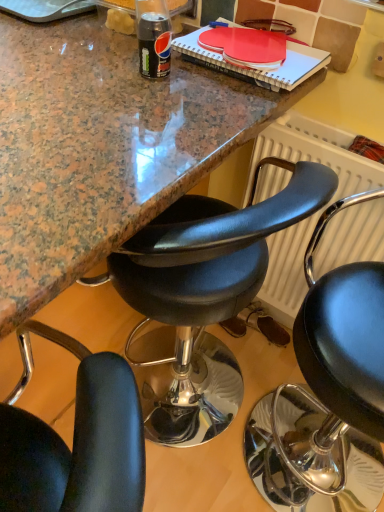
Image resolution: width=384 pixels, height=512 pixels. Describe the element at coordinates (327, 394) in the screenshot. I see `black leather chair at center, the 1th chair viewed from the right` at that location.

This screenshot has height=512, width=384. In order to click on black leather chair at center, which is the second chair from left to right in this screenshot , I will do `click(327, 394)`.

Is black leather chair at center, which is the second chair from left to right, touching white textured radiator at right?

black leather chair at center, which is the second chair from left to right, is not next to white textured radiator at right, and they're not touching.

Between point (322, 349) and point (271, 239), which one is positioned behind?

The point (271, 239) is farther.

From the image's perspective, which object appears higher, black leather chair at center, which is the second chair from left to right, or white textured radiator at right?

white textured radiator at right, from the image's perspective.

From the image's perspective, which object appears higher, white textured radiator at right or black leather chair at center, arranged as the first chair when viewed from the left?

From the image's view, white textured radiator at right is above.

Is white textured radiator at right facing away from black leather chair at center, arranged as the first chair when viewed from the left?

No, white textured radiator at right's orientation is not away from black leather chair at center, arranged as the first chair when viewed from the left.

Which point is more forward, (290, 313) or (321, 168)?

The point (321, 168) is more forward.

Can you confirm if white textured radiator at right is wider than black leather chair at center, positioned as the second chair in right-to-left order?

No, white textured radiator at right is not wider than black leather chair at center, positioned as the second chair in right-to-left order.

Which is more to the left, black leather chair at center, positioned as the second chair in right-to-left order, or white textured radiator at right?

black leather chair at center, positioned as the second chair in right-to-left order, is more to the left.

From a real-world perspective, does black leather chair at center, positioned as the second chair in right-to-left order, stand above white textured radiator at right?

No, from a real-world perspective, black leather chair at center, positioned as the second chair in right-to-left order, is not on top of white textured radiator at right.

Considering the sizes of black leather chair at center, arranged as the first chair when viewed from the left, and white textured radiator at right in the image, is black leather chair at center, arranged as the first chair when viewed from the left, wider or thinner than white textured radiator at right?

Considering their sizes, black leather chair at center, arranged as the first chair when viewed from the left, looks broader than white textured radiator at right.

Is white textured radiator at right turned away from black leather chair at center, which is the second chair from left to right?

That's not correct — white textured radiator at right is not looking away from black leather chair at center, which is the second chair from left to right.

Where is `radiator behind the black leather chair at center, the 1th chair viewed from the right`? This screenshot has height=512, width=384. radiator behind the black leather chair at center, the 1th chair viewed from the right is located at coordinates [x=316, y=153].

Is there a large distance between white textured radiator at right and black leather chair at center, which is the second chair from left to right?

No, white textured radiator at right is not far away from black leather chair at center, which is the second chair from left to right.

From a real-world perspective, is black leather chair at center, arranged as the first chair when viewed from the left, positioned above or below black leather chair at center, the 1th chair viewed from the right?

black leather chair at center, arranged as the first chair when viewed from the left, is below black leather chair at center, the 1th chair viewed from the right.

How many degrees apart are the facing directions of black leather chair at center, positioned as the second chair in right-to-left order, and black leather chair at center, which is the second chair from left to right?

black leather chair at center, positioned as the second chair in right-to-left order, and black leather chair at center, which is the second chair from left to right, are facing 0.00126 degrees away from each other.

Is black leather chair at center, positioned as the second chair in right-to-left order, next to black leather chair at center, the 1th chair viewed from the right, and touching it?

black leather chair at center, positioned as the second chair in right-to-left order, and black leather chair at center, the 1th chair viewed from the right, are not in contact.

Looking at their sizes, would you say black leather chair at center, arranged as the first chair when viewed from the left, is wider or thinner than black leather chair at center, the 1th chair viewed from the right?

black leather chair at center, arranged as the first chair when viewed from the left, is wider than black leather chair at center, the 1th chair viewed from the right.

Considering the sizes of objects black leather chair at center, which is the second chair from left to right, and black leather chair at center, positioned as the second chair in right-to-left order, in the image provided, who is bigger, black leather chair at center, which is the second chair from left to right, or black leather chair at center, positioned as the second chair in right-to-left order,?

Bigger between the two is black leather chair at center, which is the second chair from left to right.

Is black leather chair at center, the 1th chair viewed from the right, aimed at black leather chair at center, arranged as the first chair when viewed from the left?

Yes.

Consider the image. Is black leather chair at center, the 1th chair viewed from the right, outside of black leather chair at center, arranged as the first chair when viewed from the left?

Yes, black leather chair at center, the 1th chair viewed from the right, is located beyond the bounds of black leather chair at center, arranged as the first chair when viewed from the left.

Consider the image. Between black leather chair at center, the 1th chair viewed from the right, and black leather chair at center, arranged as the first chair when viewed from the left, which one has smaller width?

black leather chair at center, the 1th chair viewed from the right.

From the image's perspective, which chair is the 2nd one below the white textured radiator at right? Please provide its 2D coordinates.

[(327, 394)]

Find the location of a particular element. This screenshot has width=384, height=512. radiator that is on the right side of black leather chair at center, positioned as the second chair in right-to-left order is located at coordinates (316, 153).

From the image, which object appears to be nearer to black leather chair at center, arranged as the first chair when viewed from the left, black leather chair at center, which is the second chair from left to right, or white textured radiator at right?

white textured radiator at right is closer to black leather chair at center, arranged as the first chair when viewed from the left.

Based on their spatial positions, is black leather chair at center, which is the second chair from left to right, or black leather chair at center, arranged as the first chair when viewed from the left, closer to white textured radiator at right?

black leather chair at center, arranged as the first chair when viewed from the left, is positioned closer to the anchor white textured radiator at right.

Estimate the real-world distances between objects in this image. Which object is further from black leather chair at center, the 1th chair viewed from the right, black leather chair at center, arranged as the first chair when viewed from the left, or white textured radiator at right?

black leather chair at center, arranged as the first chair when viewed from the left.

When comparing their distances from black leather chair at center, the 1th chair viewed from the right, does white textured radiator at right or black leather chair at center, positioned as the second chair in right-to-left order, seem closer?

white textured radiator at right is positioned closer to the anchor black leather chair at center, the 1th chair viewed from the right.

Estimate the real-world distances between objects in this image. Which object is closer to black leather chair at center, positioned as the second chair in right-to-left order, white textured radiator at right or black leather chair at center, the 1th chair viewed from the right?

Based on the image, white textured radiator at right appears to be nearer to black leather chair at center, positioned as the second chair in right-to-left order.

When comparing their distances from white textured radiator at right, does black leather chair at center, arranged as the first chair when viewed from the left, or black leather chair at center, which is the second chair from left to right, seem closer?

Among the two, black leather chair at center, arranged as the first chair when viewed from the left, is located nearer to white textured radiator at right.

Locate an element on the screen. The height and width of the screenshot is (512, 384). chair between black leather chair at center, which is the second chair from left to right, and white textured radiator at right from front to back is located at coordinates (202, 300).